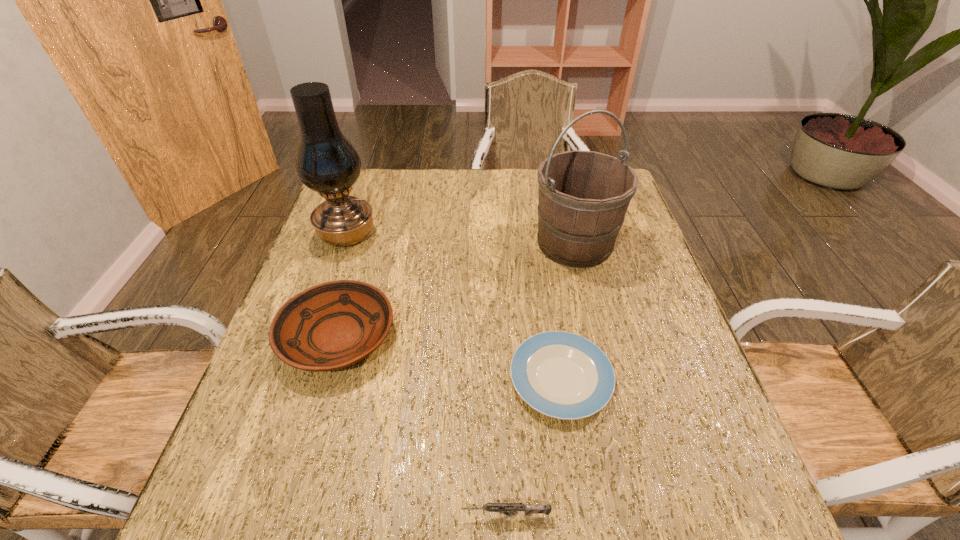
Find the location of a particular element. Image resolution: width=960 pixels, height=540 pixels. free location located on the right of the left plate is located at coordinates (462, 336).

The image size is (960, 540). I want to click on free space located aimed along the barrel of the second shortest object, so click(311, 515).

What are the coordinates of `vacant space located aimed along the barrel of the second shortest object` in the screenshot? It's located at (299, 515).

Locate an element on the screen. The width and height of the screenshot is (960, 540). free space located aimed along the barrel of the second shortest object is located at coordinates (383, 515).

In order to click on free space located on the left of the right plate in this screenshot , I will do `click(471, 379)`.

Image resolution: width=960 pixels, height=540 pixels. I want to click on object present at the near edge, so click(x=511, y=509).

What are the coordinates of `oil lamp located at the left edge` in the screenshot? It's located at (327, 163).

This screenshot has width=960, height=540. I want to click on plate located in the left edge section of the desktop, so click(x=333, y=325).

Find the location of `object that is at the right edge`. object that is at the right edge is located at coordinates [x=583, y=196].

You are a GUI agent. You are given a task and a screenshot of the screen. Output one action in this format:
    pyautogui.click(x=<x>, y=<y>)
    Task: Click on the vacant space at the far edge of the desktop
    The height and width of the screenshot is (540, 960).
    Given the screenshot: What is the action you would take?
    pyautogui.click(x=417, y=190)